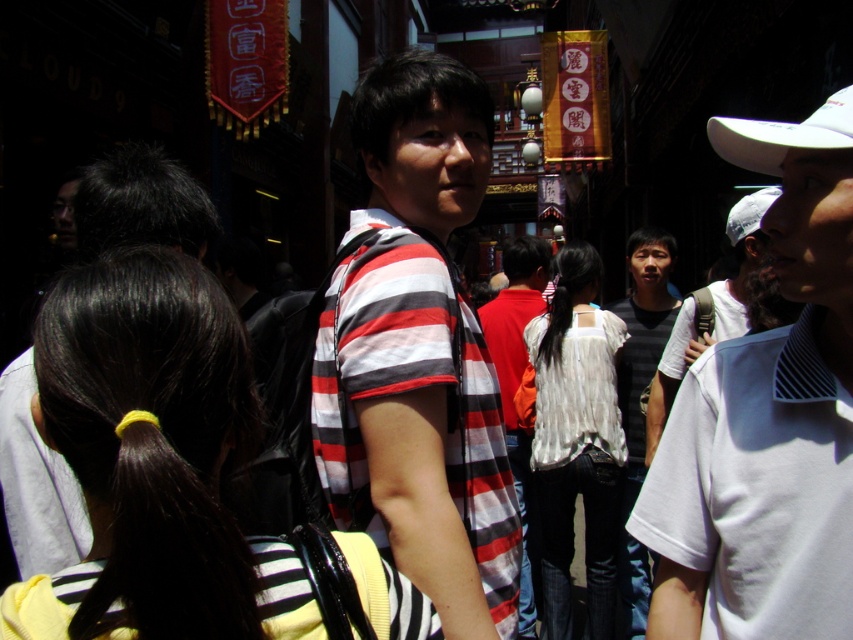
You are a photographer trying to capture a photo of the red banners in the background. You notice two people in the foreground wearing a white cotton shirt at center and a dark gray striped shirt at center. Which person should you ask to move so that the other person doesn t block the view of the banners?

You should ask the white cotton shirt at center to move because it has a smaller size compared to the dark gray striped shirt at center, so moving the smaller one would leave the larger person in frame without blocking the banners.

You are standing at the entrance of the alleyway and see a person wearing a white cotton shirt at center. If you were to walk directly towards them, which direction should you head? North, South, East, or West?

Since the white cotton shirt at center is located at point 0.656 on the x axis and 0.900 on the y axis, you should head East to reach them.

You are standing in the bustling street scene and want to take a photo of both the point at [669,323] and the point at [846,129]. Which point should you focus on first to ensure both are in clear view?

You should focus on the point at [669,323] first because it is closer to you than the point at [846,129], ensuring both points remain in clear view.